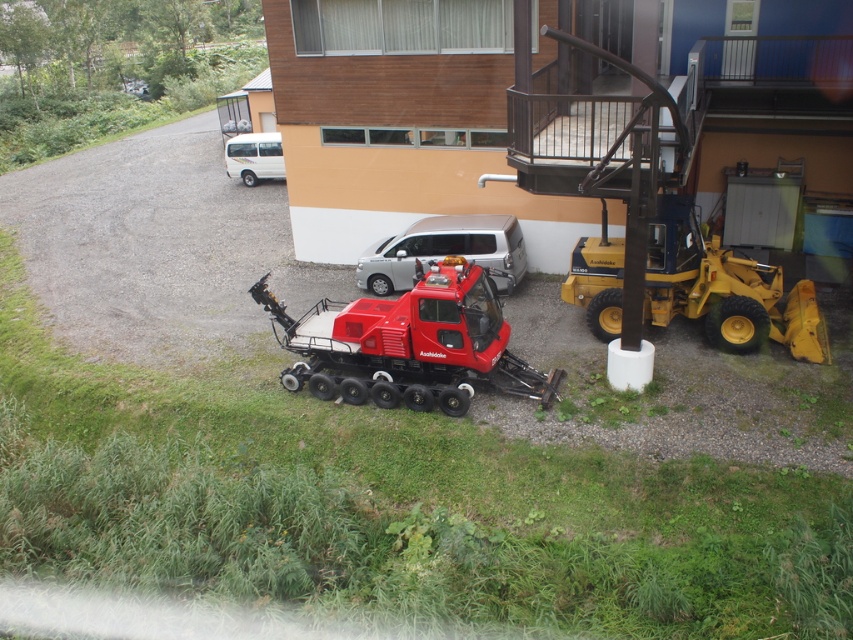
Question: Does yellow rubber tractor at right appear on the right side of silver metallic van at center?

Choices:
 (A) yes
 (B) no

Answer: (A)

Question: Is matte red snowcat at center to the left of silver metallic van at center from the viewer's perspective?

Choices:
 (A) no
 (B) yes

Answer: (B)

Question: Which object appears closest to the camera in this image?

Choices:
 (A) silver metallic van at center
 (B) yellow rubber tractor at right

Answer: (B)

Question: Can you confirm if matte red snowcat at center is smaller than yellow rubber tractor at right?

Choices:
 (A) yes
 (B) no

Answer: (B)

Question: Based on their relative distances, which object is farther from the silver metallic van at center?

Choices:
 (A) matte red snowcat at center
 (B) yellow rubber tractor at right
 (C) white matte van at upper center

Answer: (C)

Question: Which point is farther to the camera?

Choices:
 (A) yellow rubber tractor at right
 (B) silver metallic van at center

Answer: (B)